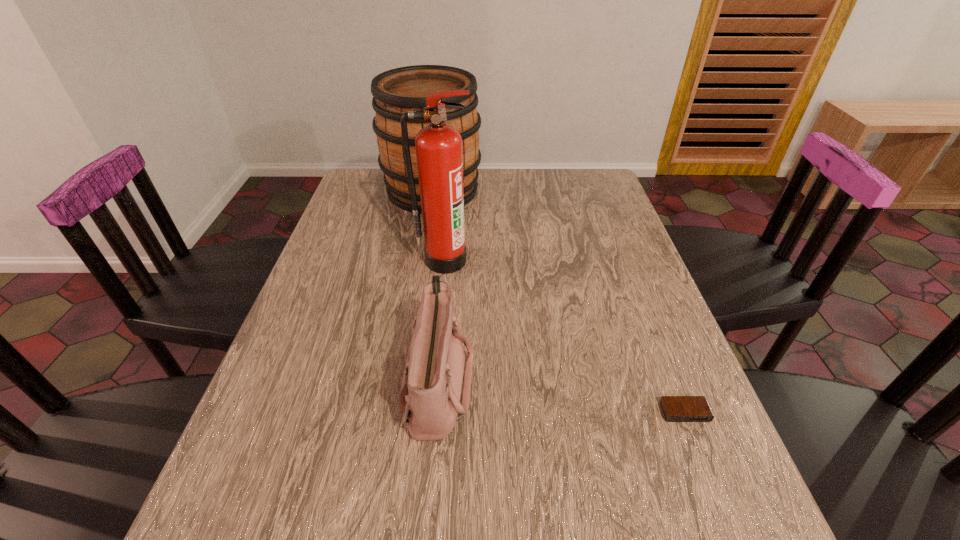
Find the location of a particular element. free space located 0.130m on the front face of the alarm clock is located at coordinates (717, 494).

At what (x,y) coordinates should I click in order to perform the action: click on object that is at the far edge. Please return your answer as a coordinate pair (x, y). The width and height of the screenshot is (960, 540). Looking at the image, I should click on (397, 91).

Locate an element on the screen. The image size is (960, 540). object that is at the left edge is located at coordinates (397, 91).

You are a GUI agent. You are given a task and a screenshot of the screen. Output one action in this format:
    pyautogui.click(x=<x>, y=<y>)
    Task: Click on the object at the right edge
    This screenshot has height=540, width=960.
    Given the screenshot: What is the action you would take?
    pyautogui.click(x=675, y=408)

I want to click on object that is at the far left corner, so click(397, 91).

Where is `blank space at the far edge of the desktop`? blank space at the far edge of the desktop is located at coordinates [510, 184].

Identify the location of free space at the near edge of the desktop. (383, 523).

Where is `vacant space at the left edge of the desktop`? Image resolution: width=960 pixels, height=540 pixels. vacant space at the left edge of the desktop is located at coordinates (301, 297).

In the image, there is a desktop. At what (x,y) coordinates should I click in order to perform the action: click on vacant space at the right edge. Please return your answer as a coordinate pair (x, y). The width and height of the screenshot is (960, 540). Looking at the image, I should click on (663, 310).

This screenshot has width=960, height=540. In the image, there is a desktop. Find the location of `vacant space at the far right corner`. vacant space at the far right corner is located at coordinates (579, 183).